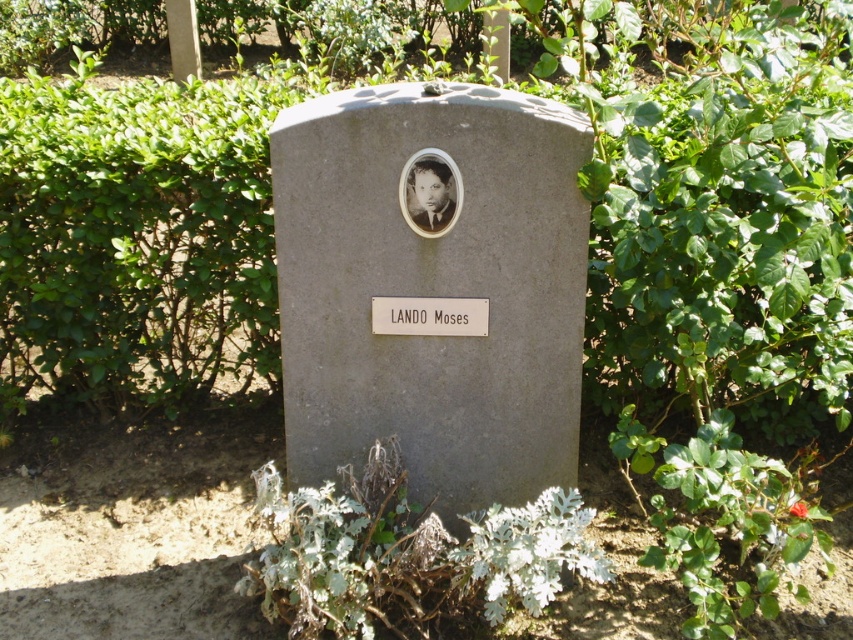
Is gray stone gravestone at center to the left of matte black face at center from the viewer's perspective?

Correct, you'll find gray stone gravestone at center to the left of matte black face at center.

Can you confirm if gray stone gravestone at center is positioned to the right of matte black face at center?

In fact, gray stone gravestone at center is to the left of matte black face at center.

The height and width of the screenshot is (640, 853). In order to click on gray stone gravestone at center in this screenshot , I will do `click(432, 289)`.